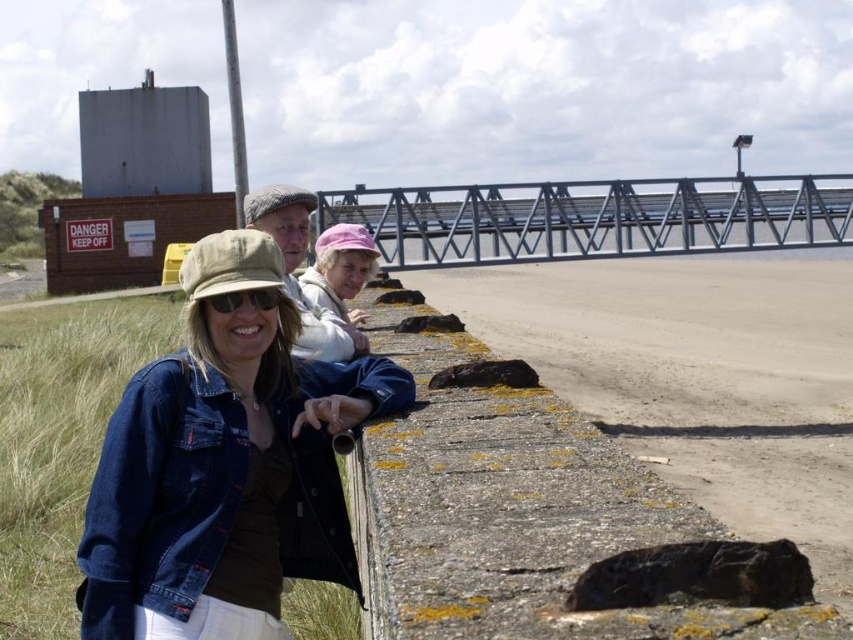
You are a photographer trying to capture a photo of the yellowish concrete wall at lower left and the denim jacket at lower left. Based on their heights, which object will appear taller in the photo?

The yellowish concrete wall at lower left will appear taller in the photo because it has a greater height compared to the denim jacket at lower left according to the description.

You are a photographer trying to capture the denim jacket at lower left and the yellowish concrete wall at lower left in the same frame. Based on their positions, can you tell which object is closer to the camera?

The yellowish concrete wall at lower left is located above the denim jacket at lower left, so the denim jacket at lower left is closer to the camera.